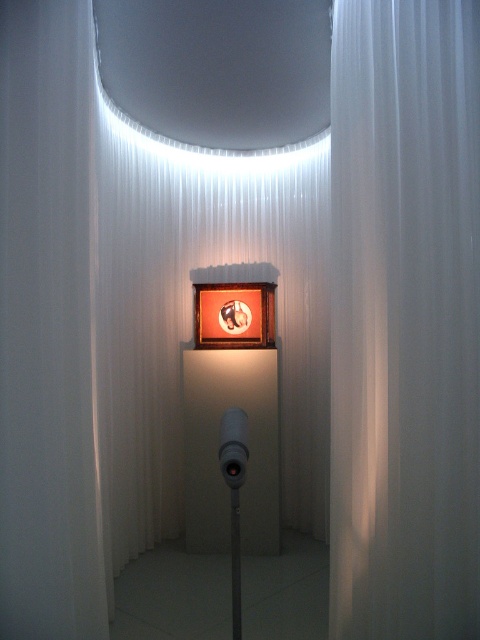
Is white matte curtain at center below matte white pole at center?

Actually, white matte curtain at center is above matte white pole at center.

Does white matte curtain at center come behind matte white pole at center?

Yes, it is.

Locate an element on the screen. The width and height of the screenshot is (480, 640). white matte curtain at center is located at coordinates (405, 320).